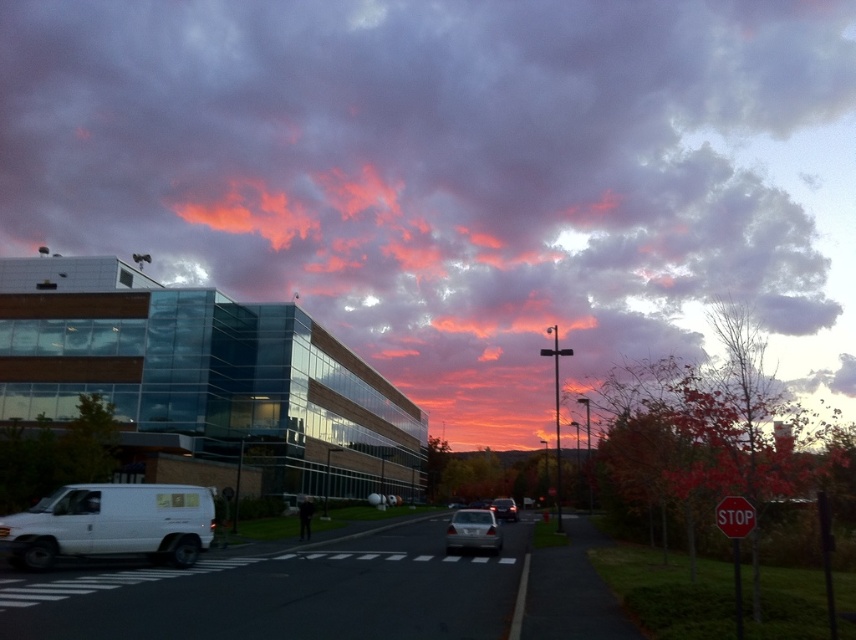
You are standing at the crosswalk in the image. Which direction should you walk to reach the white matte van at lower left?

Answer: Walk towards the lower left direction to reach the white matte van at lower left.

You are standing at the pedestrian crossing on the road and see two points marked on the ground. The first point is at coordinate point(752, 515) and the second point is at coordinate point(497, 499). If you look towards the direction of the modern building, which point is closer to you?

Point(752, 515) is in front of point(497, 499), so when looking towards the modern building, point(752, 515) is closer to you.